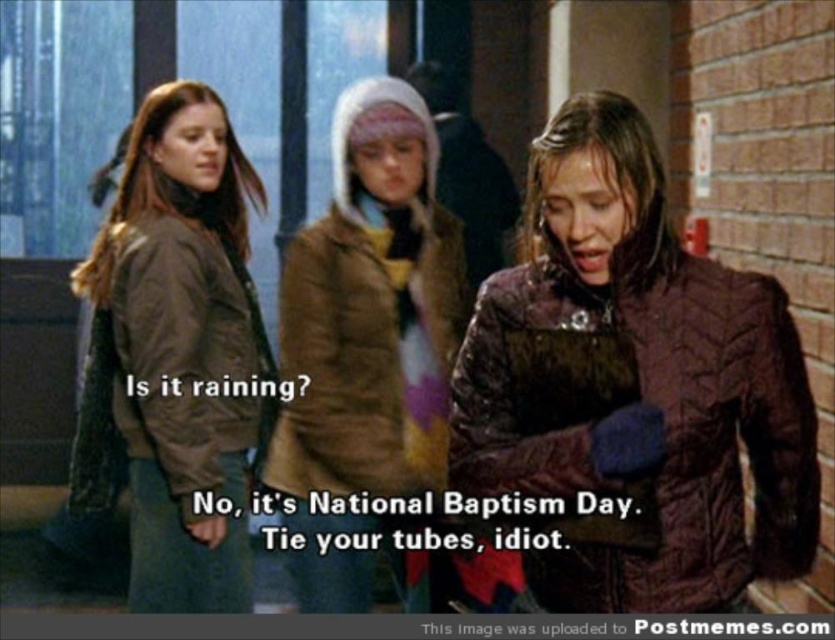
Does point (451, 468) come behind point (214, 483)?

No, (451, 468) is closer to viewer.

Locate an element on the screen. The image size is (835, 640). shiny brown jacket at center is located at coordinates (633, 387).

What do you see at coordinates (633, 387) in the screenshot? I see `shiny brown jacket at center` at bounding box center [633, 387].

Can you confirm if shiny brown jacket at center is thinner than brown quilted coat at center?

Incorrect, shiny brown jacket at center's width is not less than brown quilted coat at center's.

Between point (522, 422) and point (377, 483), which one is positioned behind?

Positioned behind is point (377, 483).

Find the location of `shiny brown jacket at center`. shiny brown jacket at center is located at coordinates 633,387.

Can you confirm if brown quilted jacket at left is shorter than brown quilted coat at center?

Indeed, brown quilted jacket at left has a lesser height compared to brown quilted coat at center.

Can you confirm if brown quilted jacket at left is positioned to the left of brown quilted coat at center?

Correct, you'll find brown quilted jacket at left to the left of brown quilted coat at center.

At what (x,y) coordinates should I click in order to perform the action: click on brown quilted jacket at left. Please return your answer as a coordinate pair (x, y). This screenshot has width=835, height=640. Looking at the image, I should click on (176, 353).

At what (x,y) coordinates should I click in order to perform the action: click on brown quilted jacket at left. Please return your answer as a coordinate pair (x, y). The height and width of the screenshot is (640, 835). Looking at the image, I should click on (176, 353).